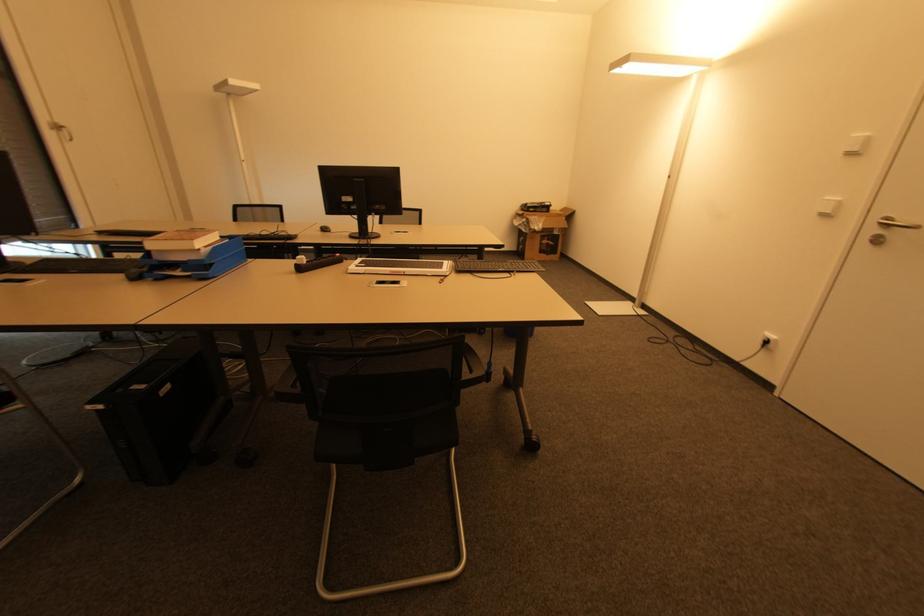
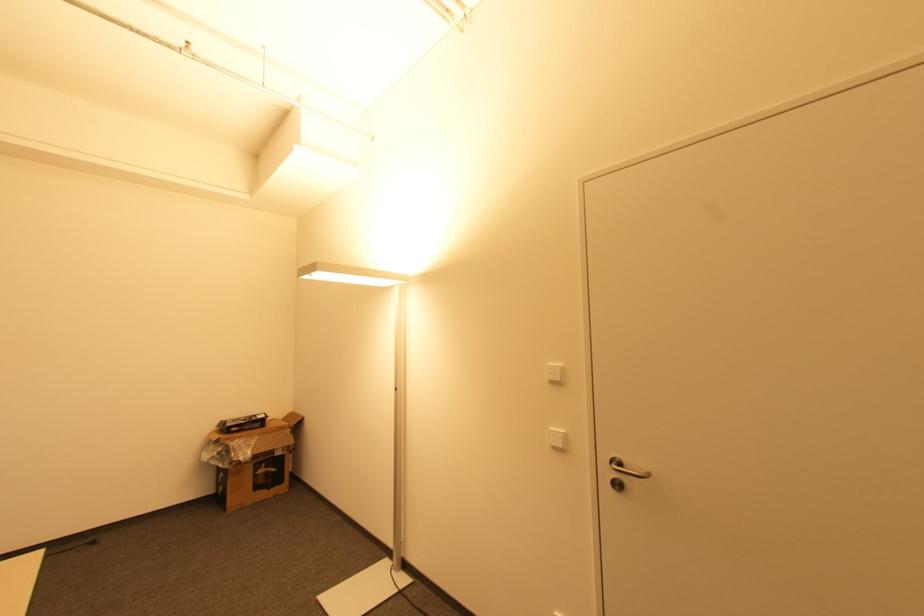
In the second image, find the point that corresponds to the point at 550,245 in the first image.

(268, 472)